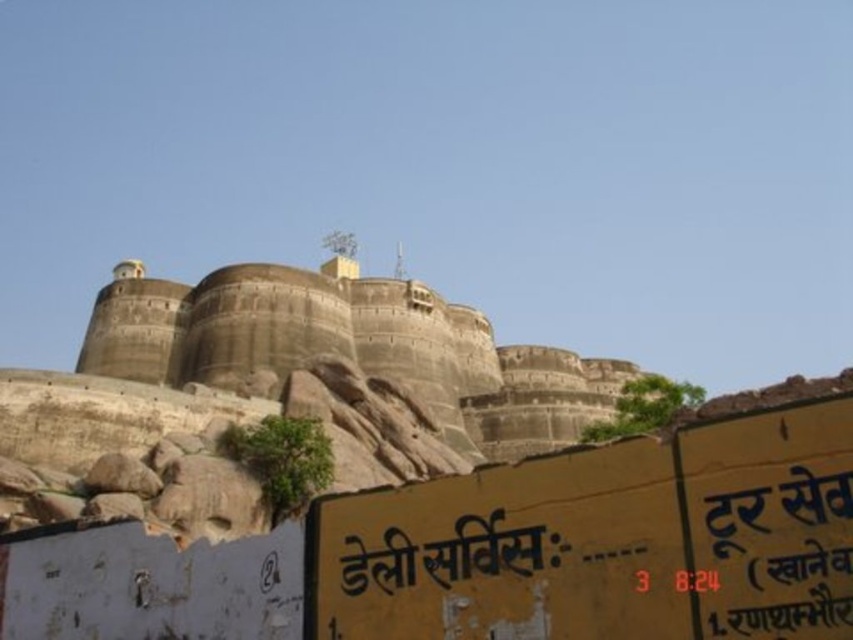
You are a tourist standing at the base of the gray stone castle at center. You want to take a photo of the castle with your smartphone. The camera app shows that the distance to the subject should be at least 50 meters for optimal focus. Will your photo be in focus?

The distance between you and the gray stone castle at center is 54.01 meters, which is more than the required 50 meters. Therefore, the photo should be in focus.

You are standing at a viewpoint near the ancient fortification. You see two points marked on the image. The first point is at coordinates point (387, 294) and the second point is at point (395, 588). Which point is closer to you?

Point (395, 588) is closer to you because according to the description, point (387, 294) is behind point (395, 588).